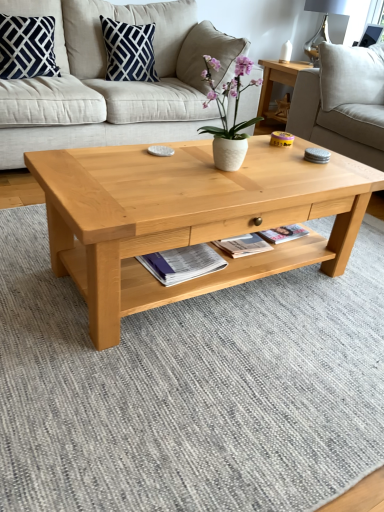
Identify the location of vacant space underneath white ceramic vase at center (from a real-world perspective). (215, 172).